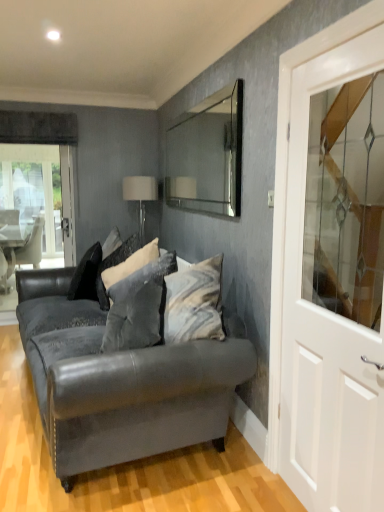
Question: Considering the positions of velvet gray pillow at center, arranged as the 3th pillow when viewed from the back, and white fabric lampshade at upper center in the image, is velvet gray pillow at center, arranged as the 3th pillow when viewed from the back, bigger or smaller than white fabric lampshade at upper center?

Choices:
 (A) big
 (B) small

Answer: (A)

Question: From a real-world perspective, relative to white fabric lampshade at upper center, is velvet gray pillow at center, arranged as the 3th pillow when viewed from the back, vertically above or below?

Choices:
 (A) above
 (B) below

Answer: (B)

Question: Which is farther from the white fabric lampshade at upper center?

Choices:
 (A) black velvet pillow at center, which is the 1th pillow in back-to-front order
 (B) velvet dark gray couch at center
 (C) white glossy door at right
 (D) velvet gray pillow at center, arranged as the 3th pillow when viewed from the back
 (E) velvet gray pillow at center, placed as the second pillow when sorted from back to front

Answer: (C)

Question: Estimate the real-world distances between objects in this image. Which object is closer to the clear glass mirror at upper center?

Choices:
 (A) velvet gray pillow at center, arranged as the first pillow when viewed from the front
 (B) black velvet pillow at center, acting as the third pillow starting from the front
 (C) white fabric lampshade at upper center
 (D) white glossy door at right
 (E) velvet dark gray couch at center

Answer: (C)